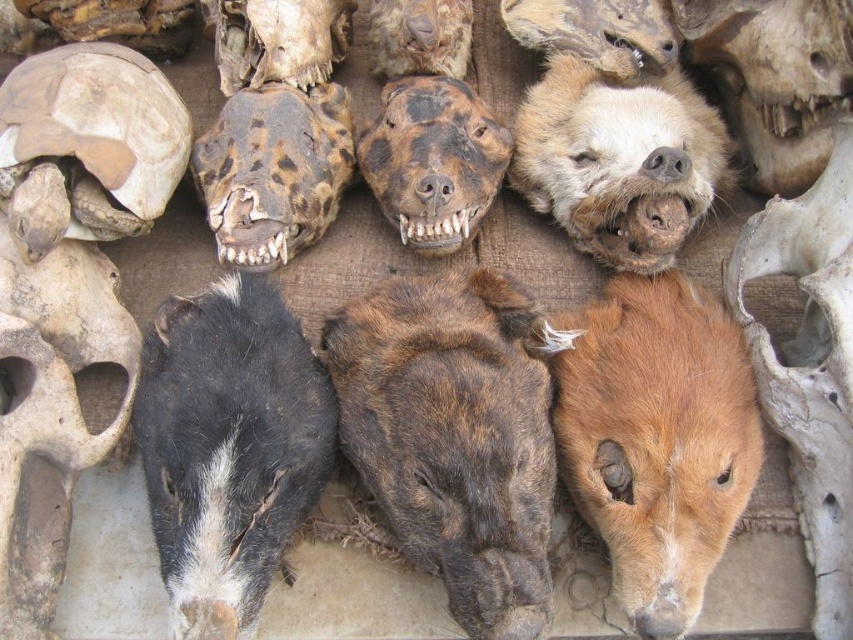
Question: Which point is closer to the camera?

Choices:
 (A) pyautogui.click(x=20, y=536)
 (B) pyautogui.click(x=320, y=35)
 (C) pyautogui.click(x=685, y=378)
 (D) pyautogui.click(x=776, y=145)

Answer: (A)

Question: Where is brown fur at center located in relation to leopard print skull at upper center in the image?

Choices:
 (A) left
 (B) right

Answer: (B)

Question: Where is brown fur at center located in relation to bone-like skull at lower left in the image?

Choices:
 (A) left
 (B) right

Answer: (B)

Question: Among these objects, which one is nearest to the camera?

Choices:
 (A) brown fur at center
 (B) brown spotted skull at center

Answer: (A)

Question: Does brown fur at center have a greater width compared to brown textured skull at upper center?

Choices:
 (A) yes
 (B) no

Answer: (A)

Question: Considering the real-world distances, which object is closest to the brown textured tortoise shell at upper left?

Choices:
 (A) brown textured skull at upper center
 (B) brown spotted skull at center

Answer: (A)